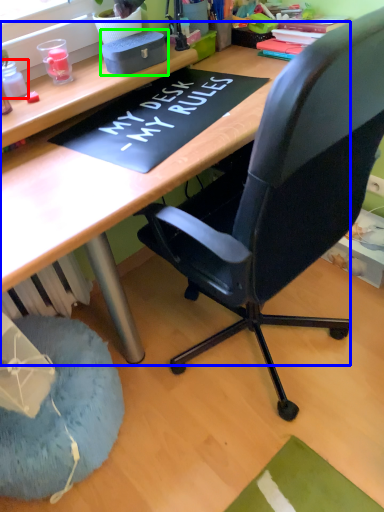
Question: Which is nearer to the stationery (highlighted by a red box)? computer desk (highlighted by a blue box) or stationery (highlighted by a green box).

Choices:
 (A) computer desk
 (B) stationery

Answer: (B)